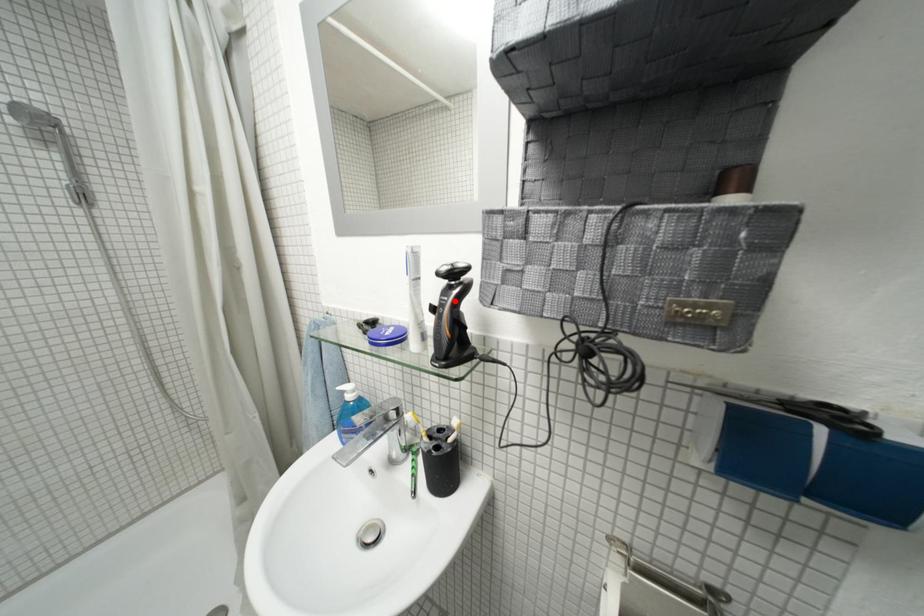
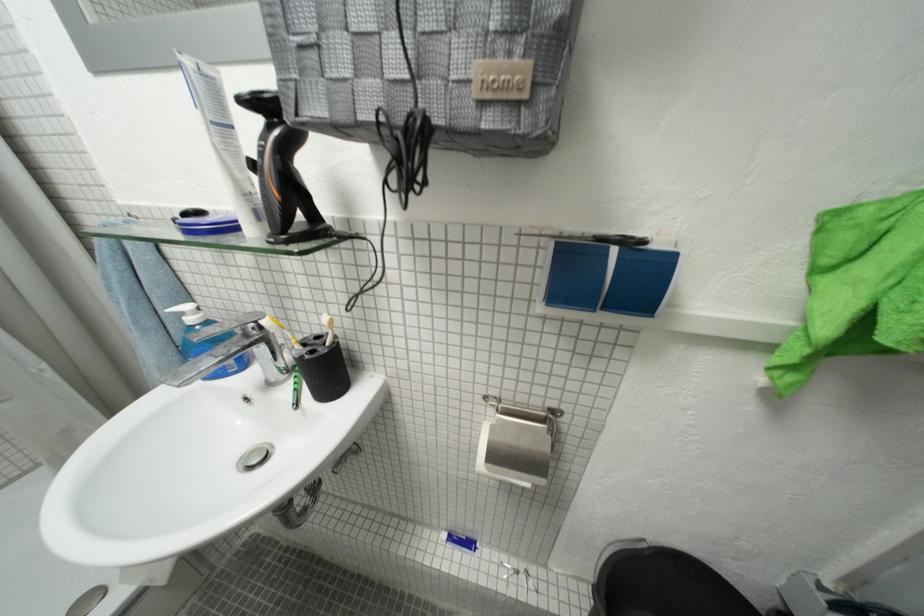
The point at the highlighted location is marked in the first image. Where is the corresponding point in the second image?

(273, 147)